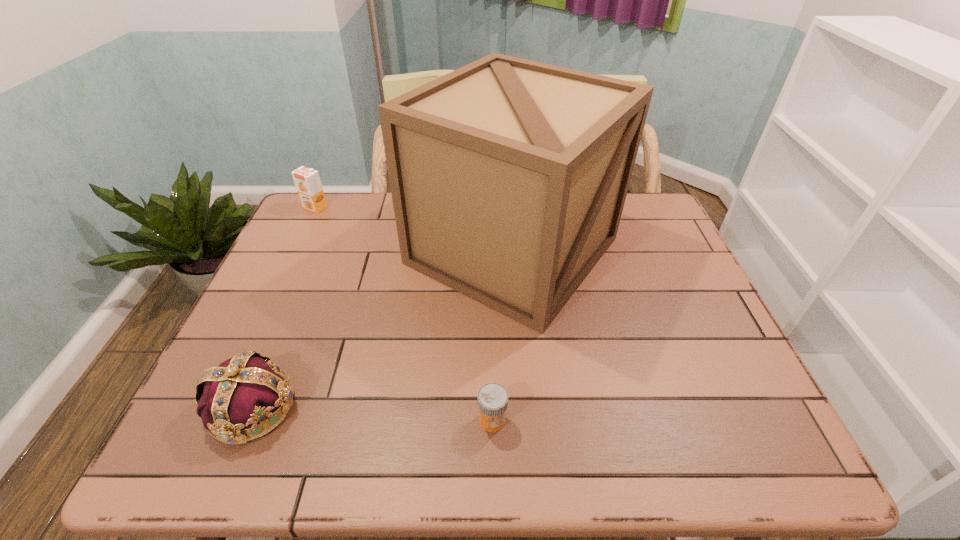
I want to click on free space that is in between the medicine and the orange juice, so click(403, 314).

You are a GUI agent. You are given a task and a screenshot of the screen. Output one action in this format:
    pyautogui.click(x=<x>, y=<y>)
    Task: Click on the vacant point located between the crown and the box
    This screenshot has height=540, width=960.
    Given the screenshot: What is the action you would take?
    pyautogui.click(x=382, y=329)

The width and height of the screenshot is (960, 540). In order to click on free area in between the crown and the orange juice in this screenshot , I will do `click(284, 308)`.

The image size is (960, 540). In order to click on free space that is in between the crown and the shortest object in this screenshot , I will do `click(372, 414)`.

Image resolution: width=960 pixels, height=540 pixels. Identify the location of vacant area between the crown and the box. (382, 329).

Locate an element on the screen. Image resolution: width=960 pixels, height=540 pixels. free point between the medicine and the orange juice is located at coordinates (403, 314).

Where is `vacant space that is in between the tallest object and the shortest object`? The image size is (960, 540). vacant space that is in between the tallest object and the shortest object is located at coordinates (502, 335).

Locate an element on the screen. free space between the orange juice and the shortest object is located at coordinates (403, 314).

In order to click on object that is the closest to the shortest object in this screenshot , I will do pos(508,177).

You are a GUI agent. You are given a task and a screenshot of the screen. Output one action in this format:
    pyautogui.click(x=<x>, y=<y>)
    Task: Click on the object that ranks as the second closest to the box
    
    Given the screenshot: What is the action you would take?
    pyautogui.click(x=492, y=399)